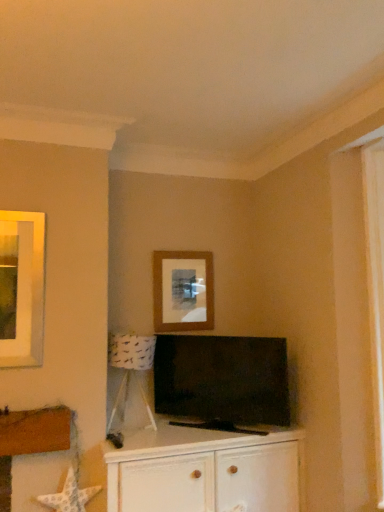
Locate an element on the screen. matte black tv at center is located at coordinates (222, 379).

In order to face white paper lampshade at lower left, should I rotate leftwards or rightwards?

To face it directly, rotate left by 7.842 degrees.

You are a GUI agent. You are given a task and a screenshot of the screen. Output one action in this format:
    pyautogui.click(x=<x>, y=<y>)
    Task: Click on the white wood cabinet at center
    
    Given the screenshot: What is the action you would take?
    pyautogui.click(x=206, y=471)

You are a GUI agent. You are given a task and a screenshot of the screen. Output one action in this format:
    pyautogui.click(x=<x>, y=<y>)
    Task: Click on the matte black tv at center
    
    Given the screenshot: What is the action you would take?
    (x=222, y=379)

This screenshot has width=384, height=512. What are the coordinates of `cabinetry below the matte brown picture frame at center (from a real-world perspective)` in the screenshot? It's located at pyautogui.click(x=206, y=471).

Can you tell me how much matte brown picture frame at center and white wood cabinet at center differ in facing direction?

They differ by 1.48 degrees in their facing directions.

Between matte brown picture frame at center and white wood cabinet at center, which one has larger width?

white wood cabinet at center.

Is matte brown picture frame at center looking in the opposite direction of white wood cabinet at center?

No, white wood cabinet at center is not at the back of matte brown picture frame at center.

Can you confirm if matte brown picture frame at center is smaller than matte black tv at center?

Indeed, matte brown picture frame at center has a smaller size compared to matte black tv at center.

Can you confirm if matte brown picture frame at center is taller than matte black tv at center?

No, matte brown picture frame at center is not taller than matte black tv at center.

Is matte brown picture frame at center far away from matte black tv at center?

No, matte brown picture frame at center is not far away from matte black tv at center.

Which of these two, matte black tv at center or white paper lampshade at lower left, is smaller?

With smaller size is white paper lampshade at lower left.

Which is behind, point (201, 403) or point (123, 344)?

The point (201, 403) is behind.

Which of these two, matte black tv at center or white paper lampshade at lower left, is wider?

white paper lampshade at lower left.

Is matte black tv at center in front of or behind white paper lampshade at lower left in the image?

Visually, matte black tv at center is located in front of white paper lampshade at lower left.

Which object is closer to the camera, matte black tv at center or matte brown picture frame at center?

matte black tv at center.

Is matte black tv at center looking in the opposite direction of matte brown picture frame at center?

No, matte brown picture frame at center is not at the back of matte black tv at center.

Who is smaller, matte black tv at center or matte brown picture frame at center?

matte brown picture frame at center.

Looking at their sizes, would you say white wood cabinet at center is wider or thinner than matte brown picture frame at center?

Clearly, white wood cabinet at center has more width compared to matte brown picture frame at center.

Is white wood cabinet at center in contact with matte brown picture frame at center?

No, white wood cabinet at center is not touching matte brown picture frame at center.

Is white wood cabinet at center facing towards matte brown picture frame at center?

No, white wood cabinet at center is not turned towards matte brown picture frame at center.

I want to click on picture frame lying above the white wood cabinet at center (from the image's perspective), so click(x=183, y=291).

Are white paper lampshade at lower left and matte black tv at center located far from each other?

No, white paper lampshade at lower left is not far from matte black tv at center.

From the image's perspective, is white paper lampshade at lower left on top of matte black tv at center?

Yes, from the image's perspective, white paper lampshade at lower left is above matte black tv at center.

Considering the positions of point (114, 410) and point (237, 417), is point (114, 410) closer or farther from the camera than point (237, 417)?

Clearly, point (114, 410) is more distant from the camera than point (237, 417).

In the scene shown: Is white paper lampshade at lower left inside or outside of matte black tv at center?

The correct answer is: outside.

What's the angular difference between white paper lampshade at lower left and matte brown picture frame at center's facing directions?

They differ by 1.9 degrees in their facing directions.

Is white paper lampshade at lower left positioned beyond the bounds of matte brown picture frame at center?

Yes, white paper lampshade at lower left is outside of matte brown picture frame at center.

Does white paper lampshade at lower left have a lesser height compared to matte brown picture frame at center?

No, white paper lampshade at lower left is not shorter than matte brown picture frame at center.

In the scene shown: Is white paper lampshade at lower left at the left side of matte brown picture frame at center?

Correct, you'll find white paper lampshade at lower left to the left of matte brown picture frame at center.

Find the location of a particular element. cabinetry below the matte brown picture frame at center (from a real-world perspective) is located at coordinates (206, 471).

Locate an element on the screen. picture frame above the matte black tv at center (from a real-world perspective) is located at coordinates (183, 291).

Based on the photo, when comparing their distances from matte black tv at center, does matte brown picture frame at center or white wood cabinet at center seem further?

Based on the image, matte brown picture frame at center appears to be further to matte black tv at center.

When comparing their distances from white wood cabinet at center, does matte brown picture frame at center or white paper lampshade at lower left seem closer?

white paper lampshade at lower left lies closer to white wood cabinet at center than the other object.

Looking at the image, which one is located closer to matte brown picture frame at center, matte black tv at center or white wood cabinet at center?

Based on the image, matte black tv at center appears to be nearer to matte brown picture frame at center.

Which object lies further to the anchor point matte black tv at center, white wood cabinet at center or matte brown picture frame at center?

Based on the image, matte brown picture frame at center appears to be further to matte black tv at center.

From the image, which object appears to be nearer to white paper lampshade at lower left, white wood cabinet at center or matte black tv at center?

matte black tv at center.

Estimate the real-world distances between objects in this image. Which object is closer to white wood cabinet at center, white paper lampshade at lower left or matte black tv at center?

matte black tv at center lies closer to white wood cabinet at center than the other object.

From the image, which object appears to be nearer to matte black tv at center, white paper lampshade at lower left or matte brown picture frame at center?

white paper lampshade at lower left is positioned closer to the anchor matte black tv at center.

Based on their spatial positions, is matte black tv at center or white paper lampshade at lower left further from matte brown picture frame at center?

Among the two, white paper lampshade at lower left is located further to matte brown picture frame at center.

Where is `lamp between matte brown picture frame at center and matte black tv at center in the vertical direction`? The height and width of the screenshot is (512, 384). lamp between matte brown picture frame at center and matte black tv at center in the vertical direction is located at coordinates (130, 370).

You are a GUI agent. You are given a task and a screenshot of the screen. Output one action in this format:
    pyautogui.click(x=<x>, y=<y>)
    Task: Click on the lamp between matte brown picture frame at center and white wood cabinet at center in the vertical direction
    The image size is (384, 512).
    Given the screenshot: What is the action you would take?
    pyautogui.click(x=130, y=370)

Identify the location of television between white paper lampshade at lower left and white wood cabinet at center vertically. (222, 379).

Find the location of a particular element. television between matte brown picture frame at center and white wood cabinet at center in the up-down direction is located at coordinates (222, 379).